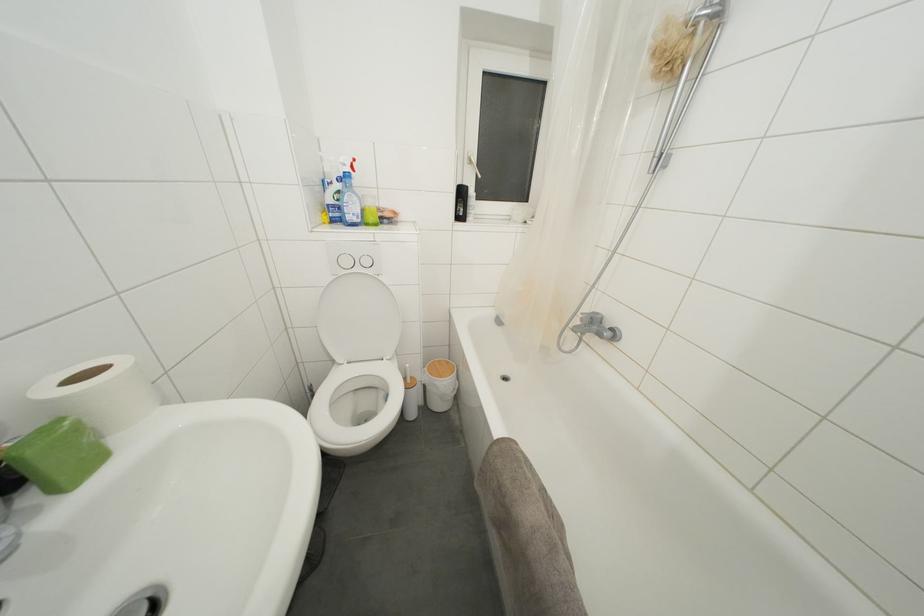
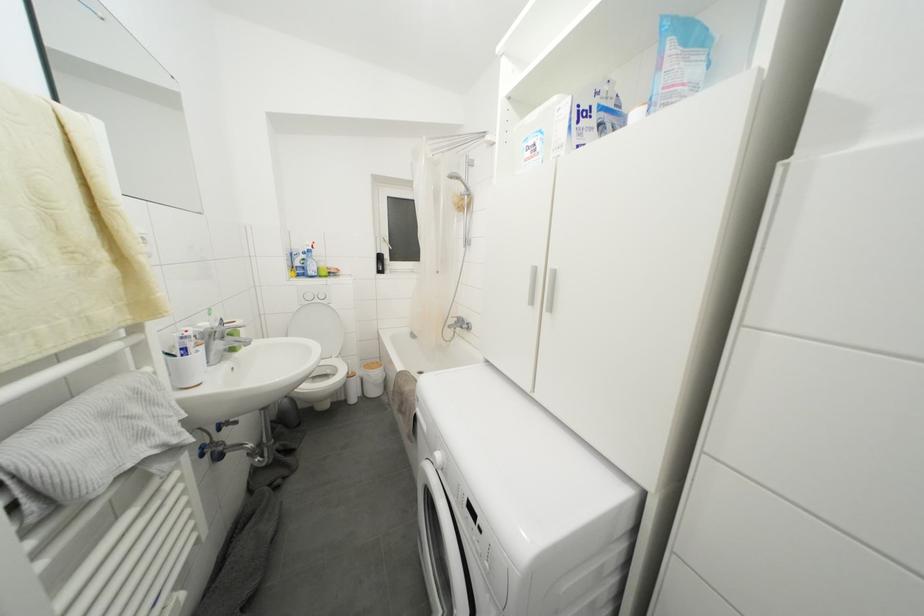
The point at (343,197) is marked in the first image. Where is the corresponding point in the second image?

(308, 264)